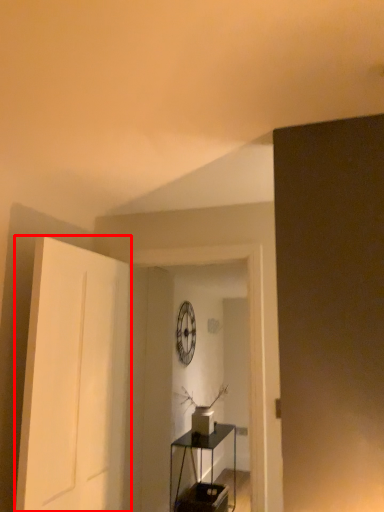
Question: From the image's perspective, considering the relative positions of door (annotated by the red box) and table in the image provided, where is door (annotated by the red box) located with respect to the staircase?

Choices:
 (A) below
 (B) above

Answer: (B)